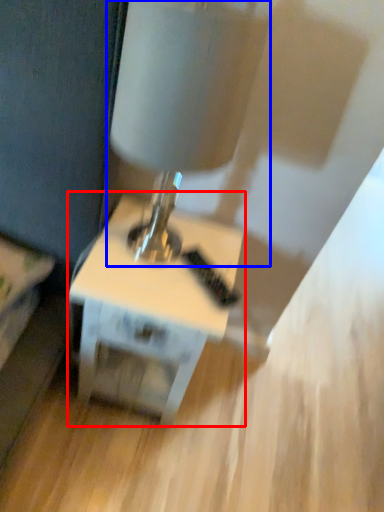
Question: Which object appears farthest to the camera in this image, table (highlighted by a red box) or table lamp (highlighted by a blue box)?

Choices:
 (A) table
 (B) table lamp

Answer: (A)